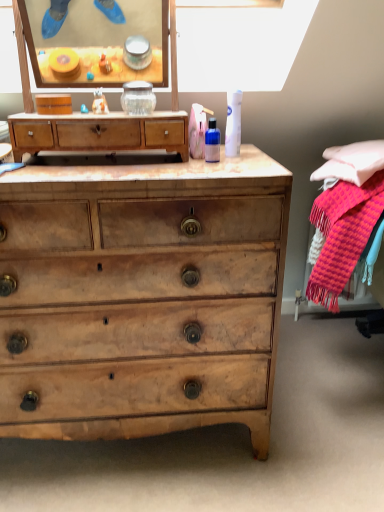
Question: Is white matte canister at upper center, positioned as the 2th toiletry in left-to-right order, to the right of translucent plastic bottle at center, positioned as the first toiletry in left-to-right order, from the viewer's perspective?

Choices:
 (A) no
 (B) yes

Answer: (B)

Question: Is white matte canister at upper center, positioned as the 2th toiletry in left-to-right order, in front of translucent plastic bottle at center, which is counted as the second toiletry, starting from the right?

Choices:
 (A) no
 (B) yes

Answer: (A)

Question: Can you confirm if white matte canister at upper center, acting as the first toiletry starting from the right, is thinner than translucent plastic bottle at center, positioned as the first toiletry in left-to-right order?

Choices:
 (A) yes
 (B) no

Answer: (B)

Question: Does white matte canister at upper center, acting as the first toiletry starting from the right, have a greater height compared to translucent plastic bottle at center, which is counted as the second toiletry, starting from the right?

Choices:
 (A) yes
 (B) no

Answer: (A)

Question: Does white matte canister at upper center, acting as the first toiletry starting from the right, have a larger size compared to translucent plastic bottle at center, which is counted as the second toiletry, starting from the right?

Choices:
 (A) yes
 (B) no

Answer: (A)

Question: Considering their positions, is translucent plastic bottle at center, which is counted as the second toiletry, starting from the right, located in front of or behind light brown wood chest of drawers at center, which is the first chest of drawers in bottom-to-top order?

Choices:
 (A) behind
 (B) front

Answer: (A)

Question: Would you say translucent plastic bottle at center, positioned as the first toiletry in left-to-right order, is to the left or to the right of light brown wood chest of drawers at center, which is the first chest of drawers in bottom-to-top order, in the picture?

Choices:
 (A) left
 (B) right

Answer: (B)

Question: Based on their sizes in the image, would you say translucent plastic bottle at center, which is counted as the second toiletry, starting from the right, is bigger or smaller than light brown wood chest of drawers at center, acting as the 2th chest of drawers starting from the top?

Choices:
 (A) big
 (B) small

Answer: (B)

Question: Does point (205, 158) appear closer or farther from the camera than point (273, 189)?

Choices:
 (A) closer
 (B) farther

Answer: (B)

Question: From the image's perspective, is light brown wooden chest of drawers at center, which ranks as the first chest of drawers in top-to-bottom order, positioned above or below light brown wood chest of drawers at center, acting as the 2th chest of drawers starting from the top?

Choices:
 (A) below
 (B) above

Answer: (B)

Question: Visually, is light brown wooden chest of drawers at center, which ranks as the first chest of drawers in top-to-bottom order, positioned to the left or to the right of light brown wood chest of drawers at center, which is the first chest of drawers in bottom-to-top order?

Choices:
 (A) left
 (B) right

Answer: (B)

Question: Considering the positions of light brown wooden chest of drawers at center, the second chest of drawers in the bottom-to-top sequence, and light brown wood chest of drawers at center, acting as the 2th chest of drawers starting from the top, in the image, is light brown wooden chest of drawers at center, the second chest of drawers in the bottom-to-top sequence, wider or thinner than light brown wood chest of drawers at center, acting as the 2th chest of drawers starting from the top,?

Choices:
 (A) thin
 (B) wide

Answer: (A)

Question: Is light brown wooden chest of drawers at center, the second chest of drawers in the bottom-to-top sequence, bigger or smaller than light brown wood chest of drawers at center, which is the first chest of drawers in bottom-to-top order?

Choices:
 (A) big
 (B) small

Answer: (B)

Question: Is point (236, 167) closer or farther from the camera than point (104, 128)?

Choices:
 (A) farther
 (B) closer

Answer: (B)

Question: In the image, is light brown wood chest of drawers at center, which is the first chest of drawers in bottom-to-top order, positioned in front of or behind light brown wooden chest of drawers at center, the second chest of drawers in the bottom-to-top sequence?

Choices:
 (A) behind
 (B) front

Answer: (B)